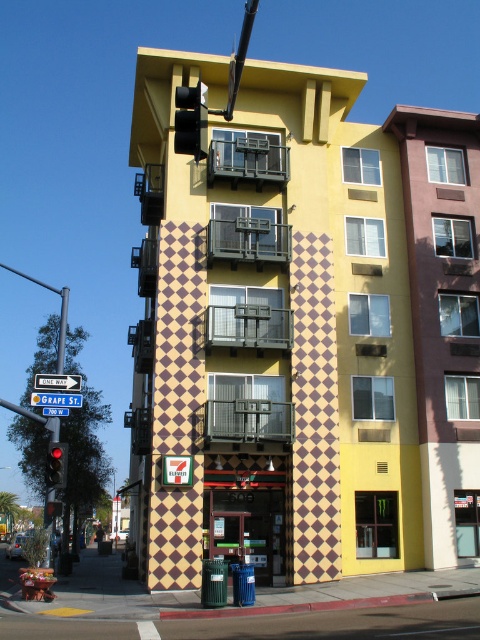
You are standing at the street corner near the red glass traffic light at left. You want to cross the road to the 7 Eleven store. Is the traffic light in front of you or to your side?

The red glass traffic light at left is located at point [57,465], so it is to your left side, meaning the traffic light is to your side rather than directly in front of you.

You are a pedestrian standing at the intersection and see the red glass traffic light at left and the blue plastic street sign at upper center. Which object is positioned more to the left?

The red glass traffic light at left is positioned more to the left than the blue plastic street sign at upper center.